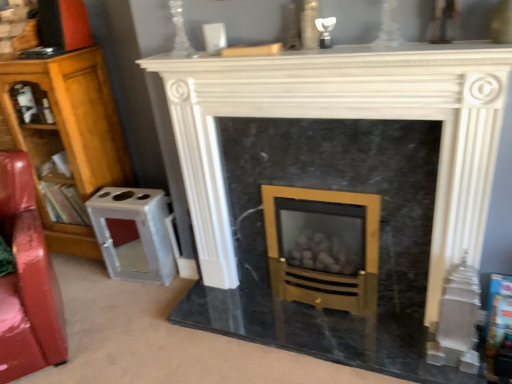
Question: From the image's perspective, is glossy red swivel chair at left located above white marble fireplace at center?

Choices:
 (A) no
 (B) yes

Answer: (A)

Question: Is glossy red swivel chair at left oriented towards white marble fireplace at center?

Choices:
 (A) yes
 (B) no

Answer: (B)

Question: Does glossy red swivel chair at left have a larger size compared to white marble fireplace at center?

Choices:
 (A) yes
 (B) no

Answer: (B)

Question: Is glossy red swivel chair at left positioned far away from white marble fireplace at center?

Choices:
 (A) no
 (B) yes

Answer: (A)

Question: Is glossy red swivel chair at left wider than white marble fireplace at center?

Choices:
 (A) yes
 (B) no

Answer: (A)

Question: From a real-world perspective, is white marble fireplace at center above or below glossy red swivel chair at left?

Choices:
 (A) below
 (B) above

Answer: (B)

Question: From the image's perspective, relative to glossy red swivel chair at left, is white marble fireplace at center above or below?

Choices:
 (A) above
 (B) below

Answer: (A)

Question: Is white marble fireplace at center wider or thinner than glossy red swivel chair at left?

Choices:
 (A) thin
 (B) wide

Answer: (A)

Question: Is point (194, 127) positioned closer to the camera than point (30, 292)?

Choices:
 (A) closer
 (B) farther

Answer: (B)

Question: Choose the correct answer: Is wooden bookcase at left inside white marble fireplace at center or outside it?

Choices:
 (A) outside
 (B) inside

Answer: (A)

Question: In terms of width, does wooden bookcase at left look wider or thinner when compared to white marble fireplace at center?

Choices:
 (A) thin
 (B) wide

Answer: (B)

Question: Is wooden bookcase at left in front of or behind white marble fireplace at center in the image?

Choices:
 (A) behind
 (B) front

Answer: (A)

Question: Visually, is wooden bookcase at left positioned to the left or to the right of white marble fireplace at center?

Choices:
 (A) left
 (B) right

Answer: (A)

Question: Looking at their shapes, would you say wooden bookcase at left is wider or thinner than glossy red swivel chair at left?

Choices:
 (A) wide
 (B) thin

Answer: (B)

Question: Is wooden bookcase at left to the left or to the right of glossy red swivel chair at left in the image?

Choices:
 (A) right
 (B) left

Answer: (B)